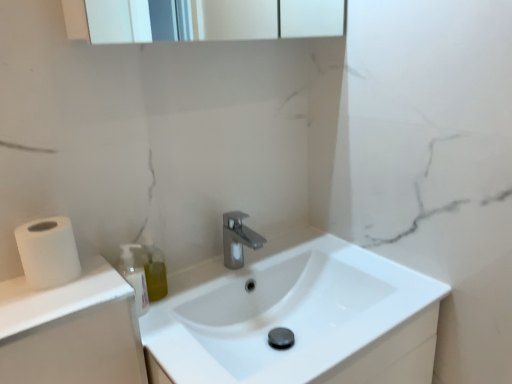
Image resolution: width=512 pixels, height=384 pixels. Find the location of `vacant space situated on the left part of satin nickel faucet at center`. vacant space situated on the left part of satin nickel faucet at center is located at coordinates (194, 280).